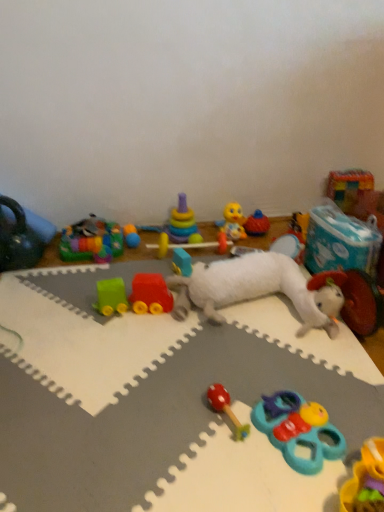
In order to click on vacant area that lies between blue rubber toy at lower right, which is the fifth toy in right-to-left order, and rubber block at center, which is the fifth toy in left-to-right order in this screenshot , I will do `click(244, 358)`.